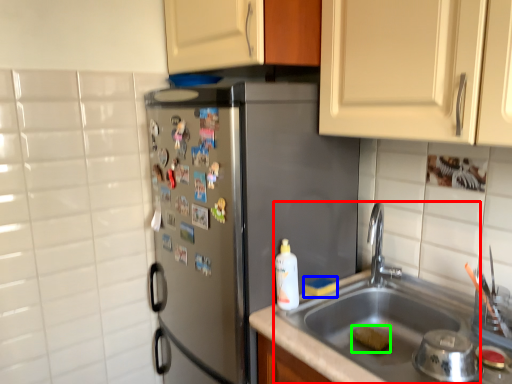
Question: Which object is the closest to the sink (highlighted by a red box)? Choose among these: food (highlighted by a blue box) or food (highlighted by a green box).

Choices:
 (A) food
 (B) food

Answer: (B)